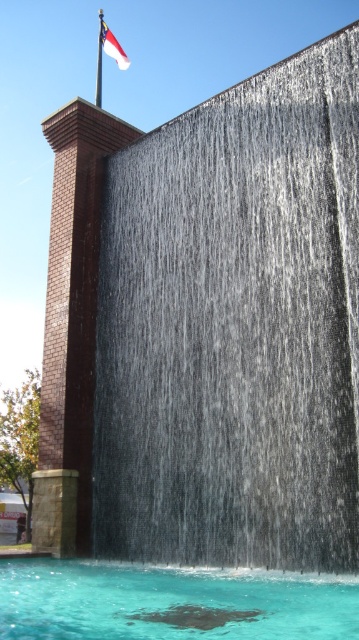
Consider the image. You are an architect reviewing the building design. You need to install a lighting fixture that will illuminate both the silver metallic waterfall at upper center and the clear water at center. Considering their positions, which object should the light be placed closer to for optimal visibility?

The silver metallic waterfall at upper center is closer to the viewer than the clear water at center. To ensure both are well lit, the light should be placed closer to the silver metallic waterfall at upper center so that its light can reach both objects effectively.

You are standing at the entrance of the building and want to locate the silver metallic waterfall at upper center. Based on the coordinates provided, where exactly should you look to find it?

The silver metallic waterfall at upper center is located at coordinates point (235, 326), so you should look towards the upper center area of the building structure to find it.